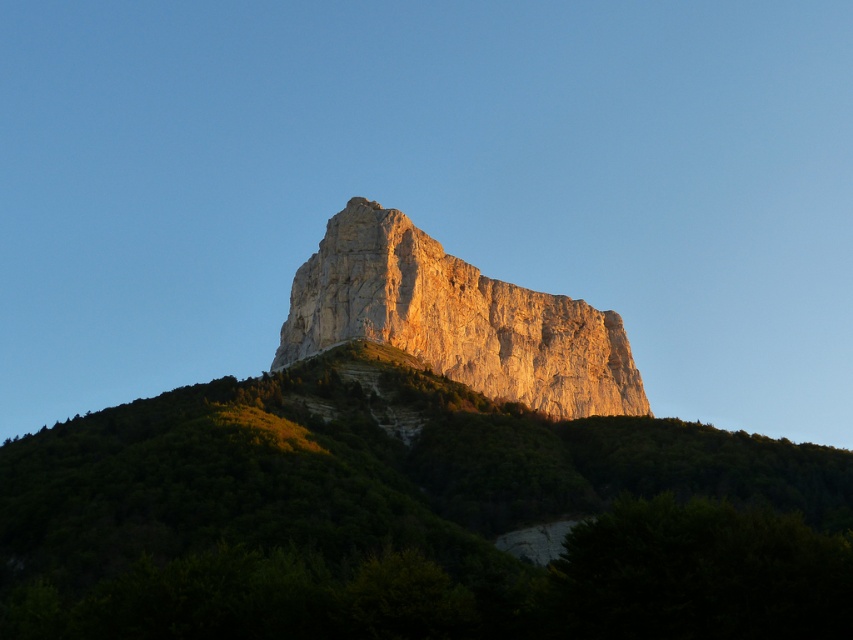
Question: In this image, where is green textured hillside at center located relative to smooth beige rock at center?

Choices:
 (A) above
 (B) below

Answer: (B)

Question: Which of the following is the farthest from the observer?

Choices:
 (A) smooth beige rock at center
 (B) green textured hillside at center

Answer: (A)

Question: Which point is closer to the camera?

Choices:
 (A) smooth beige rock at center
 (B) green textured hillside at center

Answer: (B)

Question: Is green textured hillside at center smaller than smooth beige rock at center?

Choices:
 (A) yes
 (B) no

Answer: (A)

Question: Does green textured hillside at center have a greater width compared to smooth beige rock at center?

Choices:
 (A) yes
 (B) no

Answer: (A)